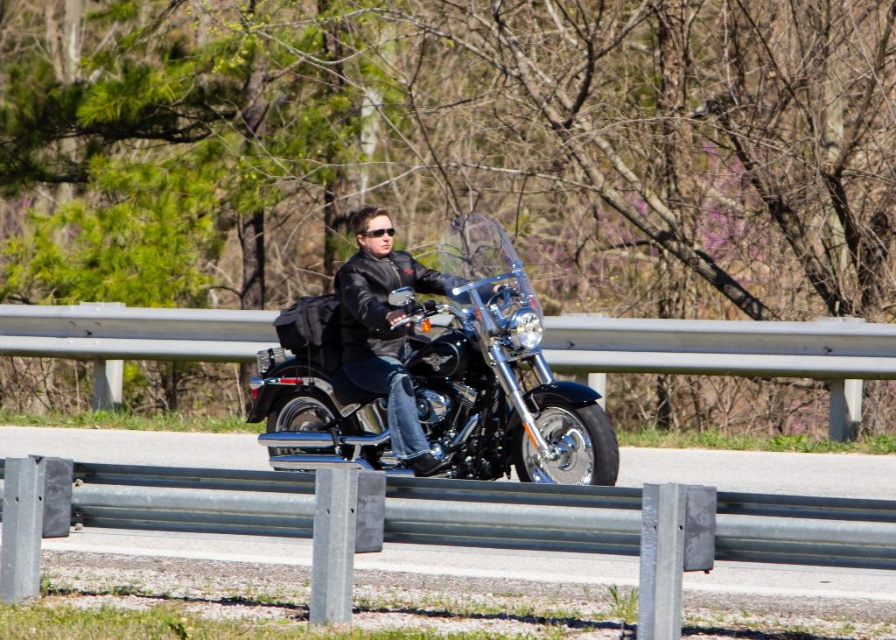
Does black leather jacket at center appear over black plastic sunglasses at center?

No, black leather jacket at center is not above black plastic sunglasses at center.

Is point (397, 419) positioned behind point (378, 237)?

No, it is not.

Which is behind, point (340, 344) or point (359, 234)?

The point (340, 344) is behind.

Image resolution: width=896 pixels, height=640 pixels. In order to click on black leather jacket at center in this screenshot , I will do [385, 332].

Who is taller, shiny chrome motorcycle at center or black plastic sunglasses at center?

shiny chrome motorcycle at center is taller.

Does point (513, 424) come farther from viewer compared to point (393, 228)?

That is False.

I want to click on shiny chrome motorcycle at center, so click(428, 371).

Does point (419, 456) come farther from viewer compared to point (410, 449)?

No, (419, 456) is closer to viewer.

Looking at this image, is shiny chrome motorcycle at center shorter than black leather jacket at center?

No, shiny chrome motorcycle at center is not shorter than black leather jacket at center.

Is point (272, 445) positioned after point (346, 312)?

Yes, it is.

This screenshot has width=896, height=640. Identify the location of shiny chrome motorcycle at center. (428, 371).